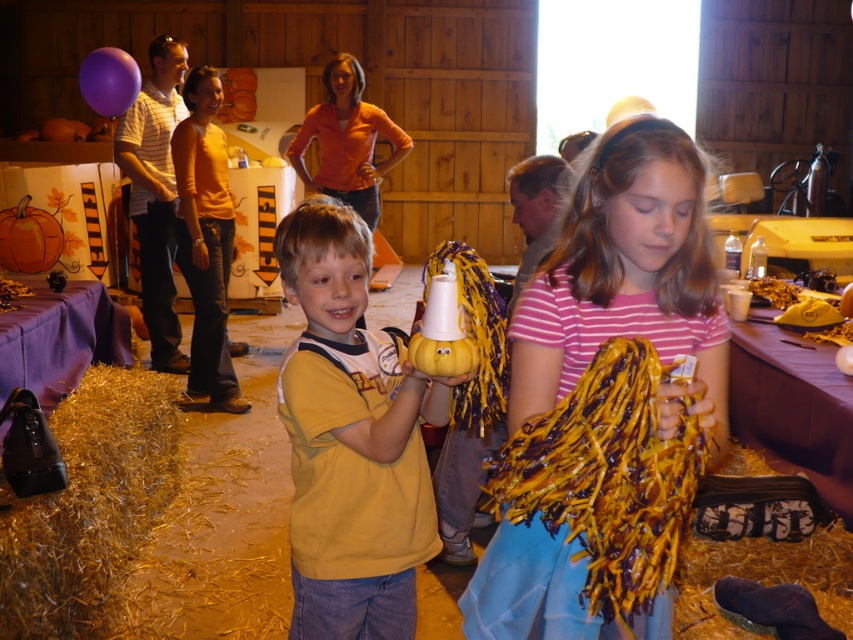
Between point (323, 228) and point (32, 253), which one is positioned behind?

Positioned behind is point (32, 253).

Measure the distance from yellow matte pumpkin at center to orange matte pumpkin at left.

The distance of yellow matte pumpkin at center from orange matte pumpkin at left is 15.46 feet.

Measure the distance between yellow matte pumpkin at center and camera.

A distance of 1.14 meters exists between yellow matte pumpkin at center and camera.

The image size is (853, 640). What are the coordinates of `yellow matte pumpkin at center` in the screenshot? It's located at coord(351,440).

Can you confirm if yellow matte pumpkin at center is bigger than gold shredded hay at lower left?

Incorrect, yellow matte pumpkin at center is not larger than gold shredded hay at lower left.

At what (x,y) coordinates should I click in order to perform the action: click on yellow matte pumpkin at center. Please return your answer as a coordinate pair (x, y). Image resolution: width=853 pixels, height=640 pixels. Looking at the image, I should click on (351, 440).

Between striped cotton shirt at center and orange matte pumpkin at left, which one appears on the left side from the viewer's perspective?

Positioned to the left is orange matte pumpkin at left.

Does point (662, 148) lie in front of point (28, 241)?

Yes.

Which is behind, point (682, 268) or point (36, 253)?

The point (36, 253) is more distant.

You are a GUI agent. You are given a task and a screenshot of the screen. Output one action in this format:
    pyautogui.click(x=<x>, y=<y>)
    Task: Click on the striped cotton shirt at center
    The width and height of the screenshot is (853, 640).
    Given the screenshot: What is the action you would take?
    pyautogui.click(x=607, y=401)